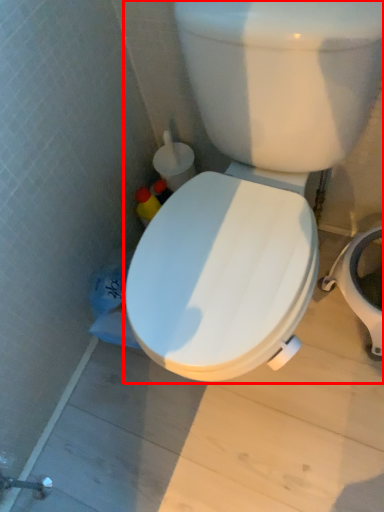
Question: From the image's perspective, where is toilet (annotated by the red box) located in relation to bidet in the image?

Choices:
 (A) above
 (B) below

Answer: (A)